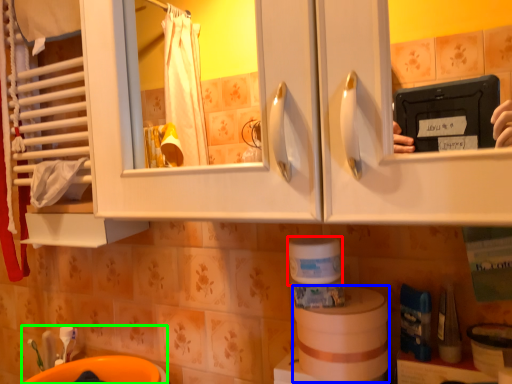
Question: Estimate the real-world distances between objects in this image. Which object is farther from toilet paper (highlighted by a red box), toilet paper (highlighted by a blue box) or sink (highlighted by a green box)?

Choices:
 (A) toilet paper
 (B) sink

Answer: (B)